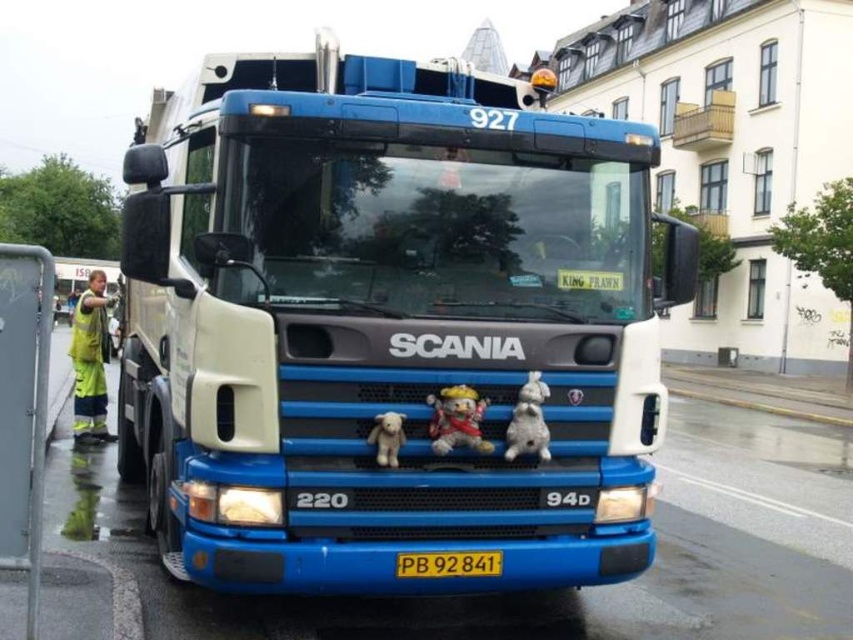
Question: Is blue matte truck at center closer to the viewer compared to fluffy plush bear at center?

Choices:
 (A) no
 (B) yes

Answer: (B)

Question: Which point is farther to the camera?

Choices:
 (A) fluffy plush bear at center
 (B) yellow plastic license plate at center

Answer: (B)

Question: Is blue matte truck at center to the right of white plush bear at center from the viewer's perspective?

Choices:
 (A) yes
 (B) no

Answer: (A)

Question: Is white plush toy at center closer to the viewer compared to yellow plastic license plate at center?

Choices:
 (A) no
 (B) yes

Answer: (A)

Question: Which object is positioned farthest from the blue matte truck at center?

Choices:
 (A) white plush toy at center
 (B) yellow plastic license plate at center

Answer: (B)

Question: Which point appears closest to the camera in this image?

Choices:
 (A) (398, 570)
 (B) (379, 460)
 (C) (471, 435)
 (D) (521, 397)

Answer: (B)